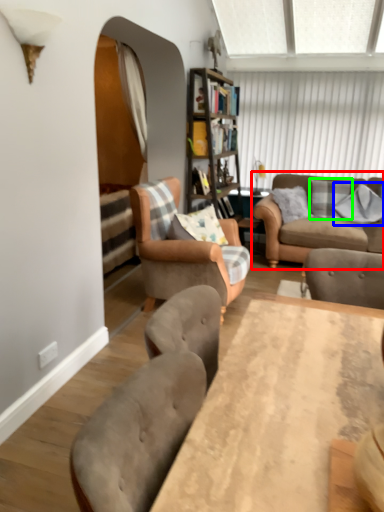
Question: Based on their relative distances, which object is nearer to studio couch (highlighted by a red box)? Choose from pillow (highlighted by a blue box) and pillow (highlighted by a green box).

Choices:
 (A) pillow
 (B) pillow

Answer: (B)